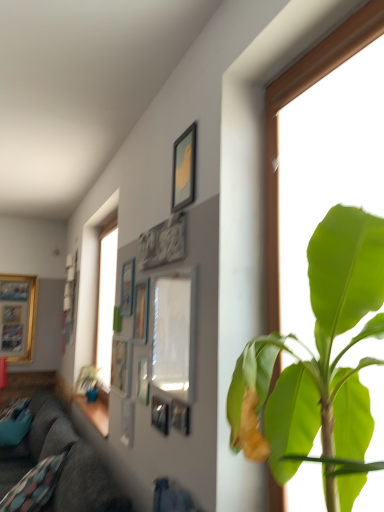
Question: Is metallic silver picture frame at upper center, which is the 11th picture frame from left to right, bigger or smaller than matte wooden picture frame at upper center, the first picture frame viewed from the right?

Choices:
 (A) small
 (B) big

Answer: (A)

Question: Considering the positions of metallic silver picture frame at upper center, which is the 2th picture frame in front-to-back order, and matte wooden picture frame at upper center, the 12th picture frame in the left-to-right sequence, in the image, is metallic silver picture frame at upper center, which is the 2th picture frame in front-to-back order, wider or thinner than matte wooden picture frame at upper center, the 12th picture frame in the left-to-right sequence,?

Choices:
 (A) wide
 (B) thin

Answer: (B)

Question: Estimate the real-world distances between objects in this image. Which object is farther from the metallic silver picture frame at upper center, which is the 11th picture frame from left to right?

Choices:
 (A) green leafy plant at upper center
 (B) gold-framed picture at left, which is the 1th picture frame from back to front
 (C) gray stone carving at upper center, marked as the eighth picture frame in a left-to-right arrangement
 (D) metallic silver picture frame at center, which is counted as the 4th picture frame, starting from the right
 (E) matte silver picture frame at upper center, the third picture frame when ordered from back to front

Answer: (B)

Question: Which object is the closest to the metallic silver picture frame at center, arranged as the eighth picture frame when viewed from the front?

Choices:
 (A) wooden picture frame at upper center, which ranks as the 7th picture frame in front-to-back order
 (B) matte silver picture frame at center, which is the 10th picture frame from right to left
 (C) gray stone carving at upper center, marked as the eighth picture frame in a left-to-right arrangement
 (D) dark gray fabric couch at lower left
 (E) metallic silver picture frame at center, which is counted as the 8th picture frame, starting from the back

Answer: (B)